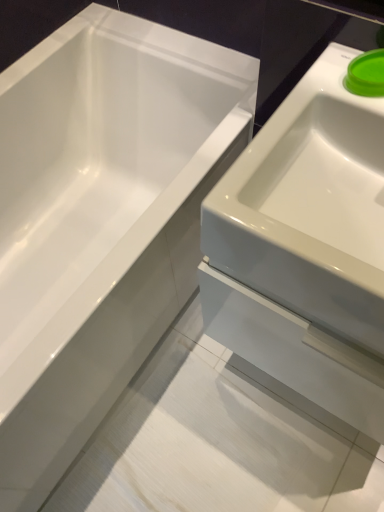
Identify the location of vacant region to the left of green plastic lid at upper right. (317, 91).